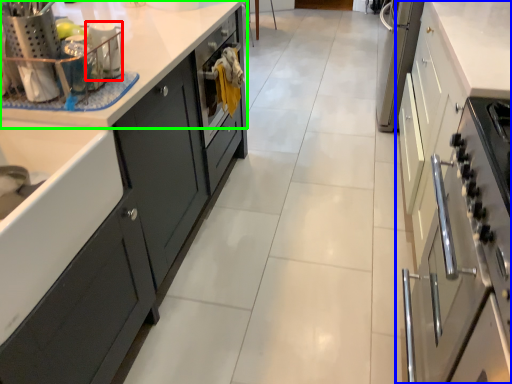
Question: Estimate the real-world distances between objects in this image. Which object is closer to appliance (highlighted by a red box), cabinetry (highlighted by a blue box) or countertop (highlighted by a green box)?

Choices:
 (A) cabinetry
 (B) countertop

Answer: (B)